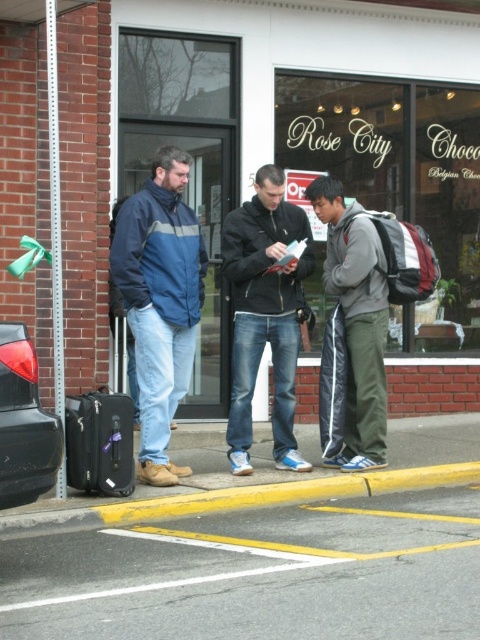
Does dark blue jeans at center have a greater width compared to yellow painted curb at lower center?

No.

Does dark blue jeans at center appear under yellow painted curb at lower center?

Actually, dark blue jeans at center is above yellow painted curb at lower center.

Which is in front, point (302, 316) or point (412, 476)?

Point (412, 476) is in front.

This screenshot has height=640, width=480. Find the location of `dark blue jeans at center`. dark blue jeans at center is located at coordinates (264, 314).

Does gray fleece jacket at center have a greater height compared to yellow painted curb at lower center?

Yes, gray fleece jacket at center is taller than yellow painted curb at lower center.

Who is more forward, (324, 211) or (347, 476)?

Point (347, 476) is in front.

I want to click on gray fleece jacket at center, so click(x=357, y=321).

Can you confirm if matte black storefront at center is bigger than yellow painted curb at lower center?

Indeed, matte black storefront at center has a larger size compared to yellow painted curb at lower center.

Does point (208, 397) come in front of point (383, 484)?

No, (208, 397) is further to viewer.

Find the location of a particular element. matte black storefront at center is located at coordinates (317, 154).